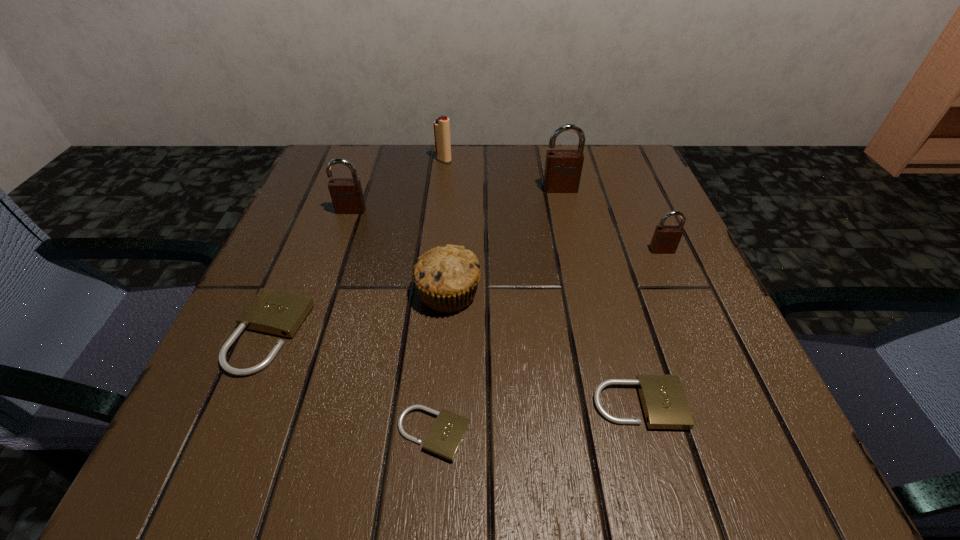
Locate an element on the screen. The height and width of the screenshot is (540, 960). free spot between the muffin and the second farthest brown padlock is located at coordinates (399, 252).

Locate an element on the screen. The height and width of the screenshot is (540, 960). unoccupied position between the rightmost beige padlock and the tallest object is located at coordinates (599, 296).

Locate an element on the screen. free point between the third shortest object and the igniter is located at coordinates (357, 247).

Locate an element on the screen. This screenshot has height=540, width=960. the fifth closest object relative to the biggest brown padlock is located at coordinates (663, 400).

Identify which object is located as the third nearest to the leftmost beige padlock. Please provide its 2D coordinates. Your answer should be formatted as a tuple, i.e. [(x, y)], where the tuple contains the x and y coordinates of a point satisfying the conditions above.

[(346, 194)]

This screenshot has height=540, width=960. Identify the location of padlock that stands as the closest to the third padlock from left to right. (663, 400).

Locate which padlock ranks second in proximity to the leftmost beige padlock. Please provide its 2D coordinates. Your answer should be formatted as a tuple, i.e. [(x, y)], where the tuple contains the x and y coordinates of a point satisfying the conditions above.

[(346, 194)]

At what (x,y) coordinates should I click in order to perform the action: click on the closest brown padlock to the biggest brown padlock. Please return your answer as a coordinate pair (x, y). Looking at the image, I should click on (666, 238).

This screenshot has height=540, width=960. What are the coordinates of `brown padlock that stands as the closest to the third farthest object` in the screenshot? It's located at (563, 168).

Identify which beige padlock is the closest to the muffin. Please provide its 2D coordinates. Your answer should be formatted as a tuple, i.e. [(x, y)], where the tuple contains the x and y coordinates of a point satisfying the conditions above.

[(447, 433)]